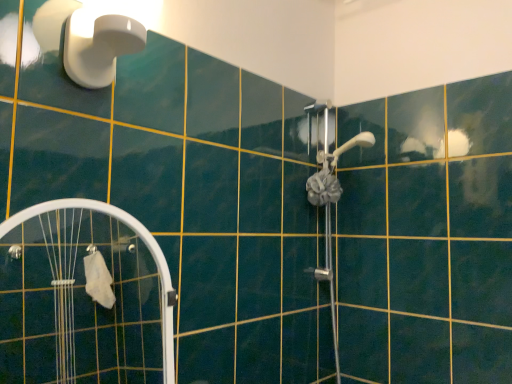
Question: Considering the relative positions of white translucent screen door at lower left and white plastic shower at upper left in the image provided, is white translucent screen door at lower left to the left or to the right of white plastic shower at upper left?

Choices:
 (A) right
 (B) left

Answer: (B)

Question: From the image's perspective, is white translucent screen door at lower left positioned above or below white plastic shower at upper left?

Choices:
 (A) below
 (B) above

Answer: (A)

Question: Is white translucent screen door at lower left in front of or behind white plastic shower at upper left in the image?

Choices:
 (A) front
 (B) behind

Answer: (A)

Question: In terms of size, does white plastic shower at upper left appear bigger or smaller than white translucent screen door at lower left?

Choices:
 (A) big
 (B) small

Answer: (B)

Question: Considering the positions of point (96, 11) and point (26, 350), is point (96, 11) closer or farther from the camera than point (26, 350)?

Choices:
 (A) closer
 (B) farther

Answer: (A)

Question: From a real-world perspective, is white plastic shower at upper left above or below white translucent screen door at lower left?

Choices:
 (A) below
 (B) above

Answer: (B)

Question: Considering the positions of white plastic shower at upper left and white translucent screen door at lower left in the image, is white plastic shower at upper left taller or shorter than white translucent screen door at lower left?

Choices:
 (A) short
 (B) tall

Answer: (A)